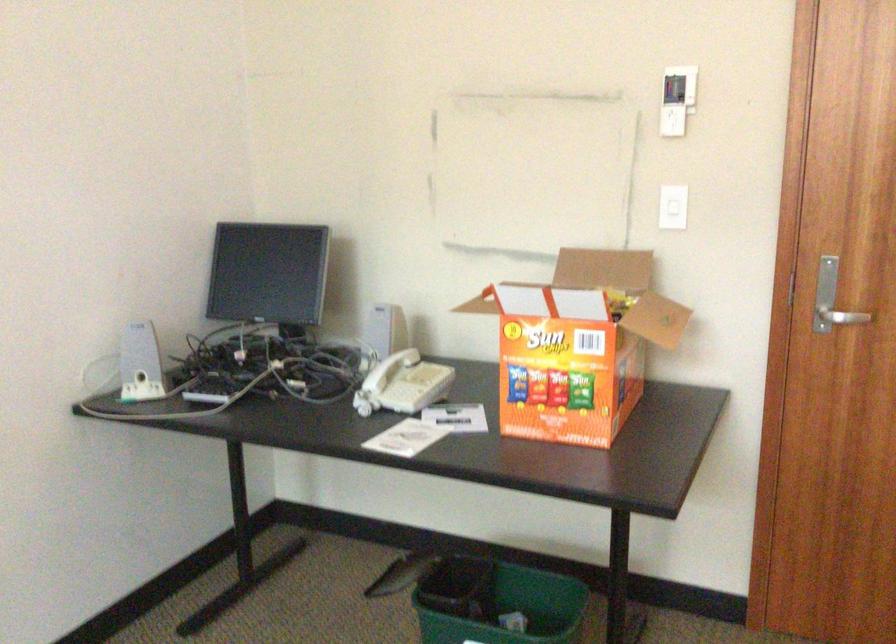
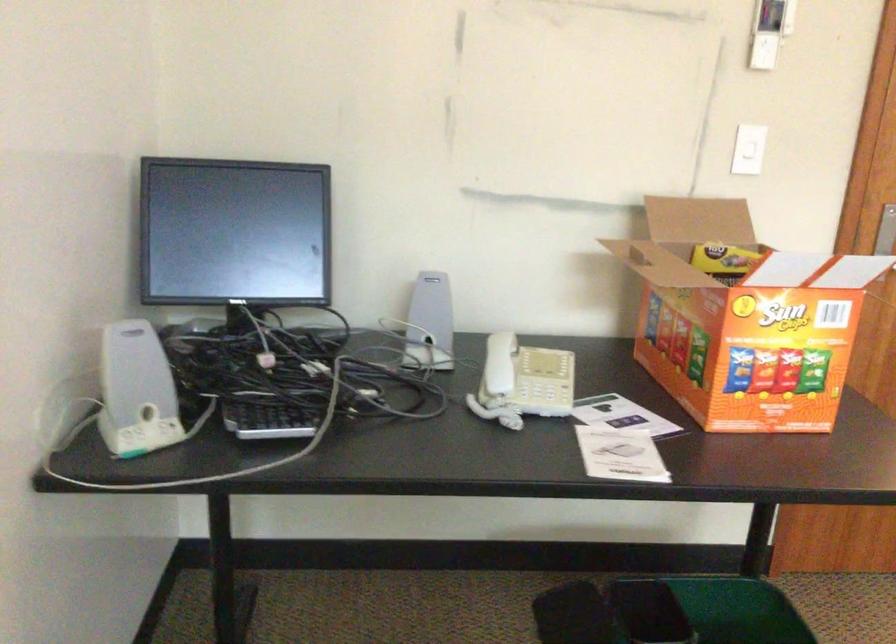
Which direction would the cameraman need to move to produce the second image?

The movement direction of the cameraman is left, forward.